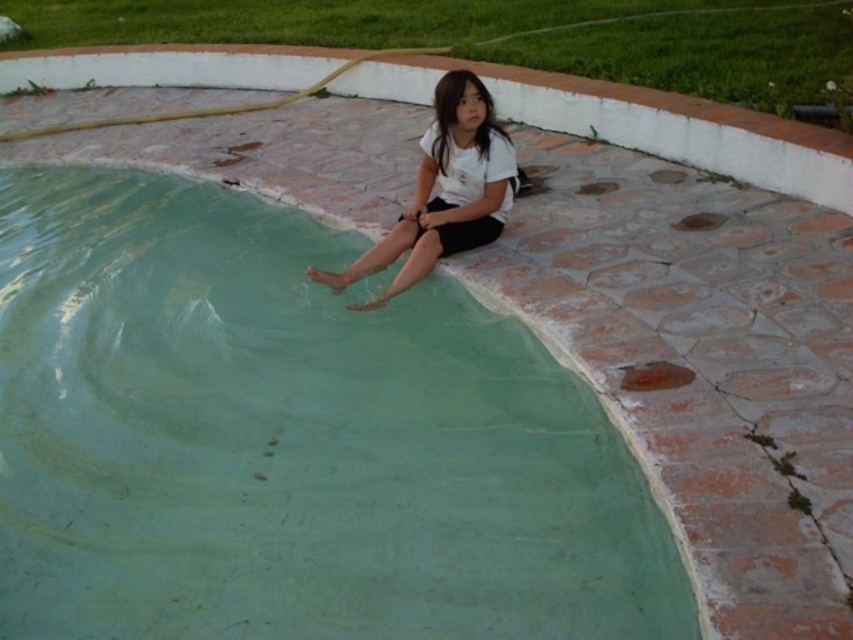
Question: Among these points, which one is farthest from the camera?

Choices:
 (A) (405, 260)
 (B) (468, 516)

Answer: (A)

Question: Is green concrete swimming pool at upper center bigger than white matte shirt at upper center?

Choices:
 (A) yes
 (B) no

Answer: (A)

Question: Among these objects, which one is farthest from the camera?

Choices:
 (A) white matte shirt at upper center
 (B) green concrete swimming pool at upper center

Answer: (A)

Question: Can you confirm if green concrete swimming pool at upper center is positioned below white matte shirt at upper center?

Choices:
 (A) yes
 (B) no

Answer: (A)

Question: Which of the following is the closest to the observer?

Choices:
 (A) (538, 508)
 (B) (498, 164)

Answer: (A)

Question: Where is green concrete swimming pool at upper center located in relation to white matte shirt at upper center in the image?

Choices:
 (A) right
 (B) left

Answer: (B)